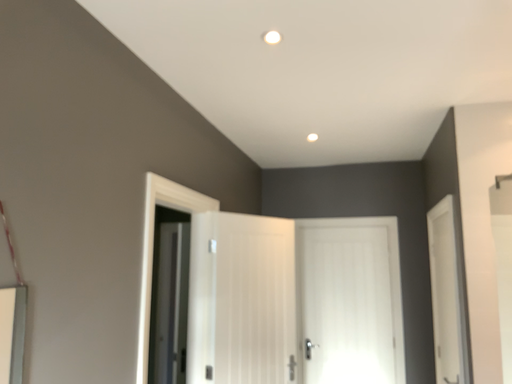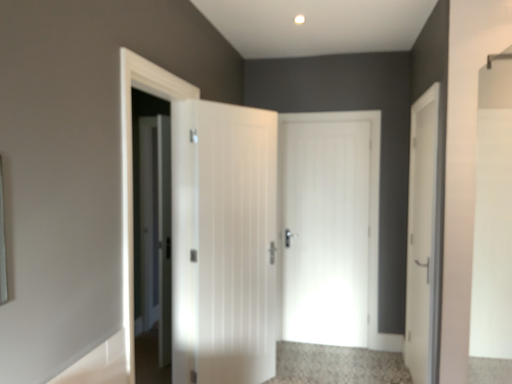
Question: Which way did the camera rotate in the video?

Choices:
 (A) rotated downward
 (B) rotated upward

Answer: (A)